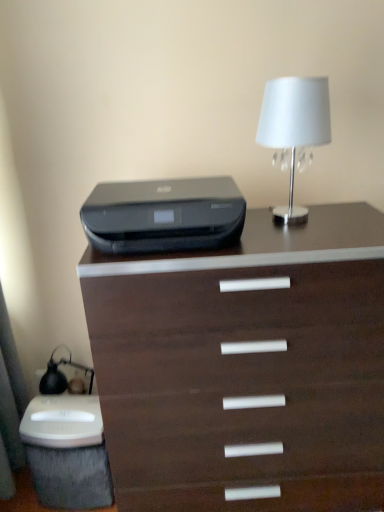
Question: Is dark wood chest of drawers at center facing away from white fabric lampshade at upper right?

Choices:
 (A) yes
 (B) no

Answer: (B)

Question: Is dark wood chest of drawers at center thinner than white fabric lampshade at upper right?

Choices:
 (A) yes
 (B) no

Answer: (B)

Question: Considering the relative positions of dark wood chest of drawers at center and white fabric lampshade at upper right in the image provided, is dark wood chest of drawers at center to the right of white fabric lampshade at upper right from the viewer's perspective?

Choices:
 (A) yes
 (B) no

Answer: (B)

Question: Considering the relative sizes of dark wood chest of drawers at center and white fabric lampshade at upper right in the image provided, is dark wood chest of drawers at center smaller than white fabric lampshade at upper right?

Choices:
 (A) yes
 (B) no

Answer: (B)

Question: Considering the relative positions of dark wood chest of drawers at center and white fabric lampshade at upper right in the image provided, is dark wood chest of drawers at center to the left of white fabric lampshade at upper right from the viewer's perspective?

Choices:
 (A) yes
 (B) no

Answer: (A)

Question: Does dark wood chest of drawers at center touch white fabric lampshade at upper right?

Choices:
 (A) yes
 (B) no

Answer: (B)

Question: Considering the relative sizes of dark wood chest of drawers at center and black plastic printer at center in the image provided, is dark wood chest of drawers at center shorter than black plastic printer at center?

Choices:
 (A) yes
 (B) no

Answer: (B)

Question: Is dark wood chest of drawers at center at the left side of black plastic printer at center?

Choices:
 (A) yes
 (B) no

Answer: (B)

Question: From a real-world perspective, does dark wood chest of drawers at center sit lower than black plastic printer at center?

Choices:
 (A) no
 (B) yes

Answer: (B)

Question: Can we say dark wood chest of drawers at center lies outside black plastic printer at center?

Choices:
 (A) no
 (B) yes

Answer: (B)

Question: Is dark wood chest of drawers at center next to black plastic printer at center?

Choices:
 (A) no
 (B) yes

Answer: (A)

Question: Is dark wood chest of drawers at center bigger than black plastic printer at center?

Choices:
 (A) no
 (B) yes

Answer: (B)

Question: Can you confirm if white fabric lampshade at upper right is shorter than black plastic printer at center?

Choices:
 (A) yes
 (B) no

Answer: (B)